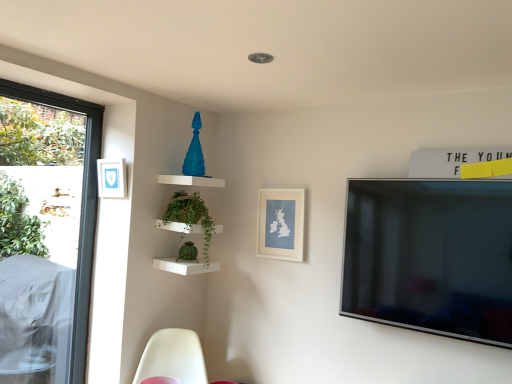
Question: Does white matte picture frame at center, which is counted as the second picture frame, starting from the front, contain blue matte picture frame at upper left, which appears as the 1th picture frame when viewed from the left?

Choices:
 (A) yes
 (B) no

Answer: (B)

Question: Is white matte picture frame at center, which is the first picture frame from back to front, thinner than blue matte picture frame at upper left, which is the second picture frame in right-to-left order?

Choices:
 (A) yes
 (B) no

Answer: (A)

Question: From a real-world perspective, is white matte picture frame at center, which is counted as the second picture frame, starting from the front, positioned under blue matte picture frame at upper left, the second picture frame when ordered from bottom to top, based on gravity?

Choices:
 (A) no
 (B) yes

Answer: (B)

Question: Is white matte picture frame at center, arranged as the 2th picture frame when viewed from the top, bigger than blue matte picture frame at upper left, which is the second picture frame in right-to-left order?

Choices:
 (A) no
 (B) yes

Answer: (B)

Question: Is white matte picture frame at center, which is counted as the second picture frame, starting from the front, facing towards blue matte picture frame at upper left, which is the second picture frame in right-to-left order?

Choices:
 (A) no
 (B) yes

Answer: (A)

Question: Is the position of white matte picture frame at center, arranged as the 2th picture frame when viewed from the top, more distant than that of blue matte picture frame at upper left, the 2th picture frame in the back-to-front sequence?

Choices:
 (A) yes
 (B) no

Answer: (A)

Question: Considering the relative positions of green wicker basket at upper center and blue matte picture frame at upper left, the second picture frame when ordered from bottom to top, in the image provided, is green wicker basket at upper center to the left of blue matte picture frame at upper left, the second picture frame when ordered from bottom to top, from the viewer's perspective?

Choices:
 (A) yes
 (B) no

Answer: (B)

Question: Could blue matte picture frame at upper left, the first picture frame viewed from the front, be considered to be inside green wicker basket at upper center?

Choices:
 (A) no
 (B) yes

Answer: (A)

Question: Considering the relative sizes of green wicker basket at upper center and blue matte picture frame at upper left, the first picture frame from the top, in the image provided, is green wicker basket at upper center shorter than blue matte picture frame at upper left, the first picture frame from the top,?

Choices:
 (A) no
 (B) yes

Answer: (A)

Question: From the image's perspective, is green wicker basket at upper center on blue matte picture frame at upper left, which is the second picture frame in right-to-left order?

Choices:
 (A) yes
 (B) no

Answer: (B)

Question: Is green wicker basket at upper center next to blue matte picture frame at upper left, the 2th picture frame in the back-to-front sequence, and touching it?

Choices:
 (A) no
 (B) yes

Answer: (A)

Question: Can you confirm if green wicker basket at upper center is wider than blue matte picture frame at upper left, which is the second picture frame in right-to-left order?

Choices:
 (A) yes
 (B) no

Answer: (A)

Question: Does white plastic swivel chair at lower left come behind transparent glass window at left?

Choices:
 (A) no
 (B) yes

Answer: (A)